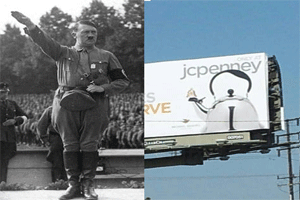
At what (x,y) coordinates should I click in order to perform the action: click on kettle. Please return your answer as a coordinate pair (x, y). The height and width of the screenshot is (200, 300). Looking at the image, I should click on (220, 107).